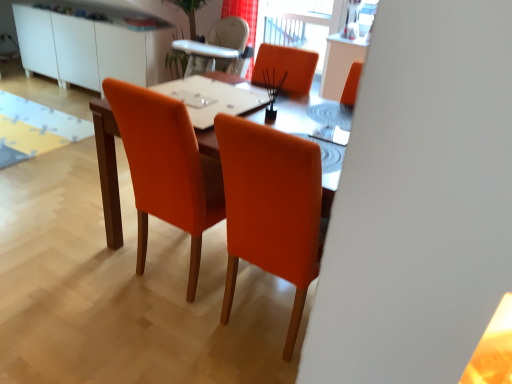
What is the approximate width of transparent glass window screen at upper center?

The width of transparent glass window screen at upper center is 4.75 inches.

Find the location of `red fabric curtain at upper center`. red fabric curtain at upper center is located at coordinates (243, 15).

The height and width of the screenshot is (384, 512). What do you see at coordinates (166, 168) in the screenshot? I see `orange fabric chair at center` at bounding box center [166, 168].

Find the location of a particular element. The image size is (512, 384). white glossy cabinet at upper left is located at coordinates (88, 49).

I want to click on white glossy table at center, so click(212, 98).

How far apart are orange fabric chair at center and white glossy table at center?

orange fabric chair at center is 32.73 centimeters away from white glossy table at center.

From the picture: Is orange fabric chair at center further to the viewer compared to white glossy table at center?

No.

From their relative heights in the image, would you say orange fabric chair at center is taller or shorter than white glossy table at center?

Clearly, orange fabric chair at center is taller compared to white glossy table at center.

You are a GUI agent. You are given a task and a screenshot of the screen. Output one action in this format:
    pyautogui.click(x=<x>, y=<y>)
    Task: Click on the chair located below the white glossy table at center (from the image's perspective)
    
    Given the screenshot: What is the action you would take?
    pyautogui.click(x=166, y=168)

Considering the sizes of objects white glossy table at center and white glossy cabinet at upper left in the image provided, who is shorter, white glossy table at center or white glossy cabinet at upper left?

Standing shorter between the two is white glossy table at center.

Is point (203, 126) positioned after point (165, 34)?

No, it is not.

In order to click on table top to the right of white glossy cabinet at upper left in this screenshot , I will do `click(212, 98)`.

Considering the sizes of white glossy table at center and white glossy cabinet at upper left in the image, is white glossy table at center bigger or smaller than white glossy cabinet at upper left?

In the image, white glossy table at center appears to be smaller than white glossy cabinet at upper left.

Considering the sizes of objects white glossy cabinet at upper left and orange fabric chair at center in the image provided, who is wider, white glossy cabinet at upper left or orange fabric chair at center?

orange fabric chair at center is wider.

From the image's perspective, which one is positioned higher, white glossy cabinet at upper left or orange fabric chair at center?

white glossy cabinet at upper left.

How different are the orientations of white glossy cabinet at upper left and orange fabric chair at center in degrees?

179 degrees.

Is there a large distance between white glossy cabinet at upper left and orange fabric chair at center?

Indeed, white glossy cabinet at upper left is not near orange fabric chair at center.

Is white glossy table at center bigger or smaller than orange fabric chair at center?

In the image, white glossy table at center appears to be smaller than orange fabric chair at center.

Is white glossy table at center looking in the opposite direction of orange fabric chair at center?

That's right, white glossy table at center is facing away from orange fabric chair at center.

Between white glossy table at center and orange fabric chair at center, which one appears on the left side from the viewer's perspective?

orange fabric chair at center.

What's the angular difference between white glossy table at center and orange fabric chair at center's facing directions?

They differ by 1.91 degrees in their facing directions.

Could you measure the distance between transparent glass window screen at upper center and white glossy table at center?

transparent glass window screen at upper center is 5.35 feet away from white glossy table at center.

Where is `window screen that is under the white glossy table at center (from a real-world perspective)`? window screen that is under the white glossy table at center (from a real-world perspective) is located at coordinates (298, 24).

Who is shorter, transparent glass window screen at upper center or white glossy table at center?

With less height is white glossy table at center.

From the image's perspective, is transparent glass window screen at upper center above white glossy table at center?

Yes, from the image's perspective, transparent glass window screen at upper center is on top of white glossy table at center.

In the image, is white glossy cabinet at upper left positioned in front of or behind white glossy table at center?

white glossy cabinet at upper left is positioned farther from the viewer than white glossy table at center.

From a real-world perspective, is white glossy cabinet at upper left positioned over white glossy table at center based on gravity?

Incorrect, from a real-world perspective, white glossy cabinet at upper left is lower than white glossy table at center.

Is point (56, 31) positioned behind point (234, 87)?

Yes.

Find the location of `dresser that appears below the white glossy table at center (from a real-world perspective)`. dresser that appears below the white glossy table at center (from a real-world perspective) is located at coordinates (88, 49).

What's the angular difference between red fabric curtain at upper center and white glossy cabinet at upper left's facing directions?

There is a 0.0635-degree angle between the facing directions of red fabric curtain at upper center and white glossy cabinet at upper left.

From a real-world perspective, is red fabric curtain at upper center above or below white glossy cabinet at upper left?

red fabric curtain at upper center is above white glossy cabinet at upper left.

Is red fabric curtain at upper center facing towards white glossy cabinet at upper left?

No, red fabric curtain at upper center is not facing towards white glossy cabinet at upper left.

Does red fabric curtain at upper center contain white glossy cabinet at upper left?

No, white glossy cabinet at upper left is not a part of red fabric curtain at upper center.

Image resolution: width=512 pixels, height=384 pixels. What are the coordinates of `table top above the orange fabric chair at center (from the image's perspective)` in the screenshot? It's located at (212, 98).

Where is `table top that is in front of the white glossy cabinet at upper left`? table top that is in front of the white glossy cabinet at upper left is located at coordinates (212, 98).

Considering their positions, is white glossy table at center positioned further to transparent glass window screen at upper center than orange fabric chair at center?

orange fabric chair at center is further to transparent glass window screen at upper center.

Considering their positions, is white glossy cabinet at upper left positioned closer to orange fabric chair at center than white glossy table at center?

Among the two, white glossy table at center is located nearer to orange fabric chair at center.

Considering their positions, is white glossy cabinet at upper left positioned further to orange fabric chair at center than red fabric curtain at upper center?

white glossy cabinet at upper left is further to orange fabric chair at center.

Based on their spatial positions, is transparent glass window screen at upper center or white glossy table at center closer to orange fabric chair at center?

white glossy table at center lies closer to orange fabric chair at center than the other object.

Which object lies further to the anchor point white glossy table at center, red fabric curtain at upper center or transparent glass window screen at upper center?

Based on the image, transparent glass window screen at upper center appears to be further to white glossy table at center.

Estimate the real-world distances between objects in this image. Which object is closer to orange fabric chair at center, white glossy cabinet at upper left or transparent glass window screen at upper center?

transparent glass window screen at upper center lies closer to orange fabric chair at center than the other object.

Which object lies further to the anchor point white glossy cabinet at upper left, red fabric curtain at upper center or transparent glass window screen at upper center?

The object further to white glossy cabinet at upper left is transparent glass window screen at upper center.

Estimate the real-world distances between objects in this image. Which object is closer to white glossy cabinet at upper left, red fabric curtain at upper center or orange fabric chair at center?

red fabric curtain at upper center is closer to white glossy cabinet at upper left.

Where is `table top between orange fabric chair at center and transparent glass window screen at upper center from front to back`? table top between orange fabric chair at center and transparent glass window screen at upper center from front to back is located at coordinates (212, 98).

The image size is (512, 384). I want to click on curtain located between orange fabric chair at center and transparent glass window screen at upper center in the depth direction, so click(243, 15).

I want to click on curtain located between orange fabric chair at center and white glossy cabinet at upper left in the depth direction, so click(243, 15).

This screenshot has width=512, height=384. In order to click on window screen between orange fabric chair at center and white glossy cabinet at upper left in the front-back direction in this screenshot , I will do `click(298, 24)`.